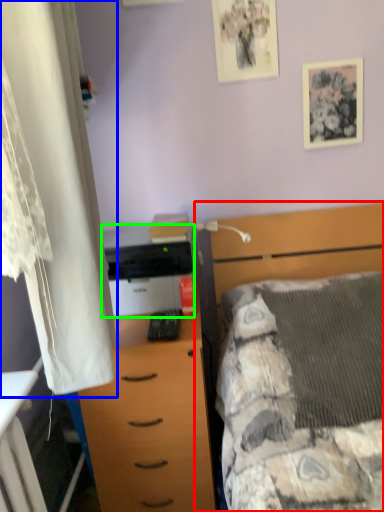
Question: Which object is the closest to the bed (highlighted by a red box)? Choose among these: curtain (highlighted by a blue box) or printer (highlighted by a green box).

Choices:
 (A) curtain
 (B) printer

Answer: (B)